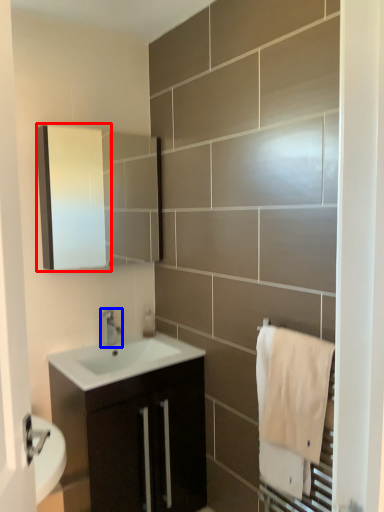
Question: Which point is further to the camera, medicine cabinet (highlighted by a red box) or tap (highlighted by a blue box)?

Choices:
 (A) medicine cabinet
 (B) tap

Answer: (B)